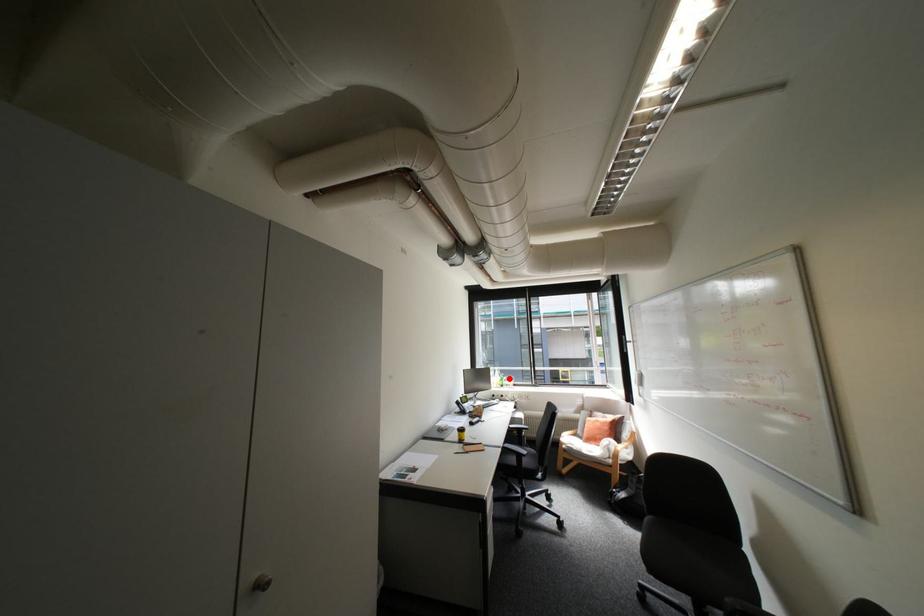
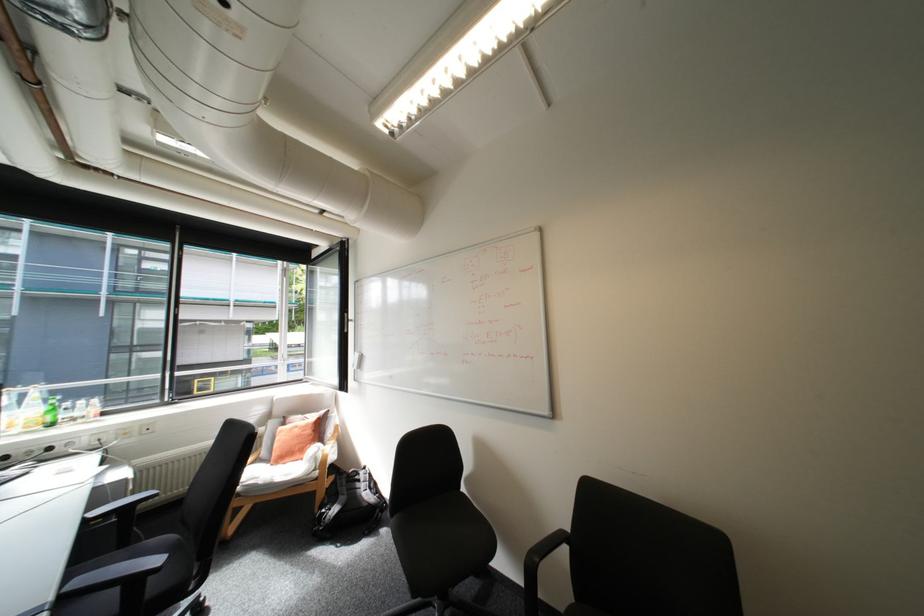
Find the pixel in the second image that matches the highlighted location in the first image.

(55, 408)